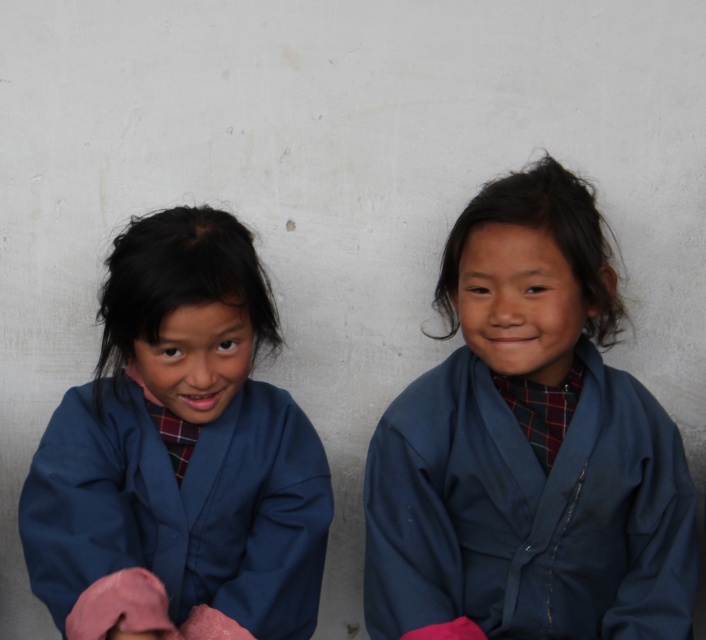
From the picture: You are standing in front of the two children in the image. You want to place a sticker on the point that is closer to you. Which point should you choose between point (164, 397) and point (453, 605)?

You should choose point (164, 397) because it is closer to you than point (453, 605).

You are a photographer setting up for a group photo. You notice the blue fabric at left and the blue cotton jacket at right are too close. What is the minimum distance you need to move them apart to ensure there is at least 1 meter between them?

The blue fabric at left and blue cotton jacket at right currently are 31.56 centimeters apart. To achieve at least 1 meter between them, they need to be moved apart by an additional 68.44 centimeters.

You are a photographer trying to capture a closeup of both the blue fabric at left and the blue cotton jacket at right in the image. Since the camera can only focus on one object at a time, which object should you focus on first if you want to ensure the other is still somewhat in the frame?

Since the blue fabric at left is to the left of blue cotton jacket at right, you should focus on the blue fabric at left first. This way, the blue cotton jacket at right will still be within the frame to the right of the focused area.